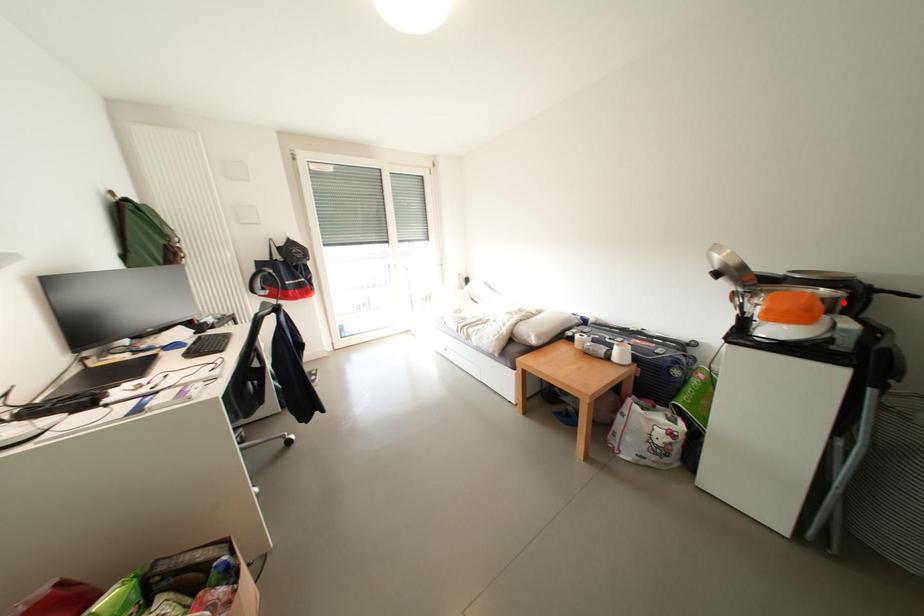
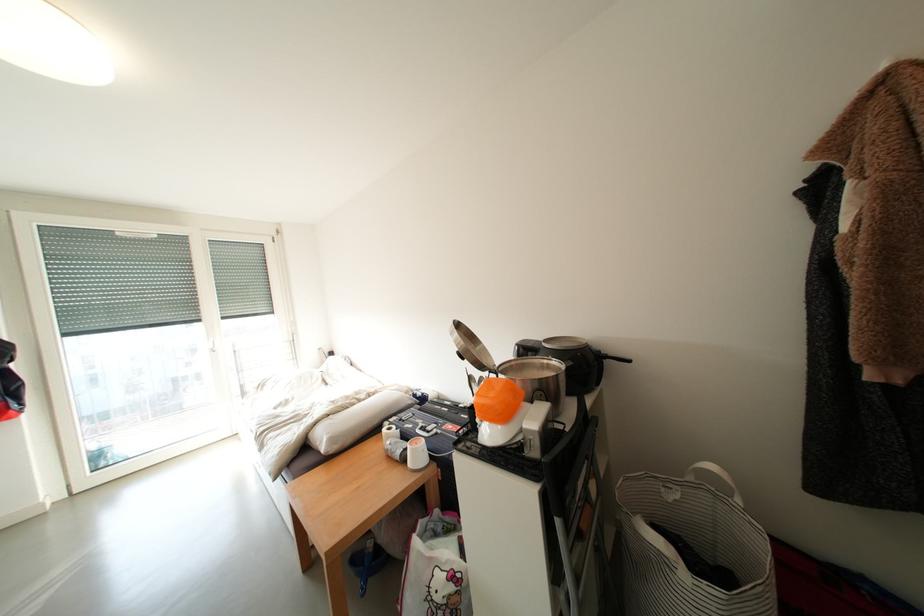
The point at the highlighted location is marked in the first image. Where is the corresponding point in the second image?

(565, 379)